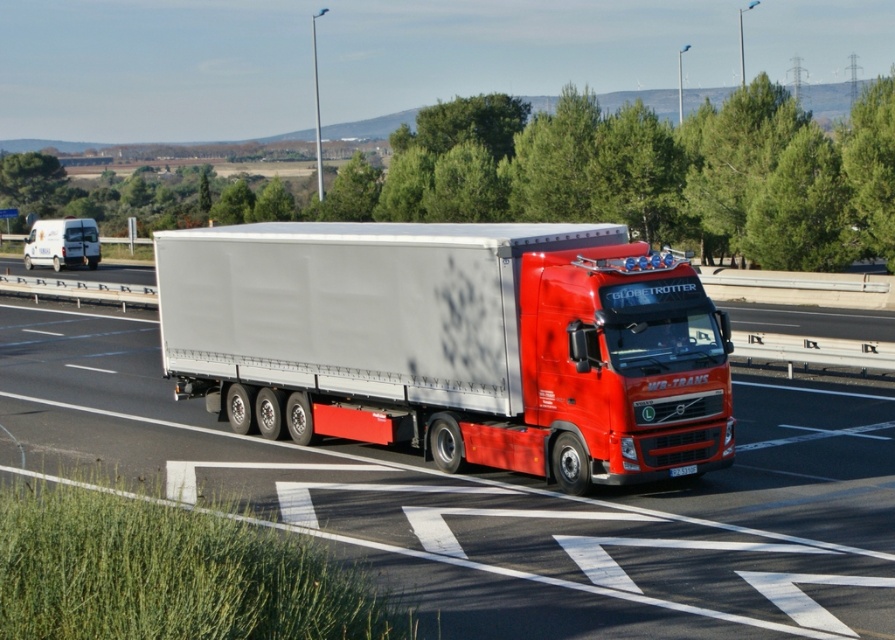
Between white matte trailer truck at center and white matte van at left, which one is positioned higher?

Positioned higher is white matte van at left.

This screenshot has height=640, width=895. Identify the location of white matte trailer truck at center. (454, 342).

Which is more to the right, white matte van at left or black plastic license plate at center?

Positioned to the right is black plastic license plate at center.

Is white matte van at left bigger than black plastic license plate at center?

Yes.

The width and height of the screenshot is (895, 640). I want to click on white matte van at left, so click(62, 243).

Can you confirm if matte white trailer at center is bigger than white matte trailer truck at center?

Indeed, matte white trailer at center has a larger size compared to white matte trailer truck at center.

Identify the location of matte white trailer at center. (497, 499).

The width and height of the screenshot is (895, 640). Describe the element at coordinates (497, 499) in the screenshot. I see `matte white trailer at center` at that location.

The image size is (895, 640). Identify the location of matte white trailer at center. (497, 499).